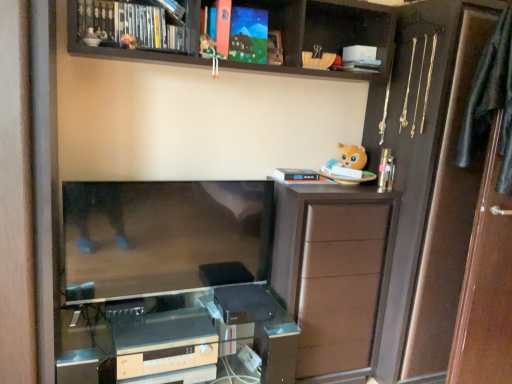
Question: Is silver metallic stereo at lower center, the first appliance from the left, completely or partially inside silver/glass computer desk at lower center?

Choices:
 (A) yes
 (B) no

Answer: (A)

Question: From a real-world perspective, is silver/glass computer desk at lower center positioned under silver metallic stereo at lower center, arranged as the 2th appliance when viewed from the top, based on gravity?

Choices:
 (A) yes
 (B) no

Answer: (A)

Question: Is silver metallic stereo at lower center, the first appliance from the left, at the back of silver/glass computer desk at lower center?

Choices:
 (A) yes
 (B) no

Answer: (A)

Question: Does silver/glass computer desk at lower center lie behind silver metallic stereo at lower center, the first appliance from the left?

Choices:
 (A) yes
 (B) no

Answer: (B)

Question: Does silver/glass computer desk at lower center have a smaller size compared to silver metallic stereo at lower center, acting as the 1th appliance starting from the bottom?

Choices:
 (A) yes
 (B) no

Answer: (B)

Question: Can you confirm if silver/glass computer desk at lower center is positioned to the right of silver metallic stereo at lower center, arranged as the 2th appliance when viewed from the top?

Choices:
 (A) yes
 (B) no

Answer: (A)

Question: Is matte plastic toy at upper center, which is the first toy in left-to-right order, outside of hardcover book at upper center, the 3th book from the left?

Choices:
 (A) no
 (B) yes

Answer: (B)

Question: Are matte plastic toy at upper center, which is the first toy in left-to-right order, and hardcover book at upper center, placed as the 3th book when sorted from top to bottom, beside each other?

Choices:
 (A) yes
 (B) no

Answer: (B)

Question: From a real-world perspective, is matte plastic toy at upper center, which is the first toy in left-to-right order, under hardcover book at upper center, the 3th book from the left?

Choices:
 (A) no
 (B) yes

Answer: (B)

Question: From the image's perspective, would you say matte plastic toy at upper center, which appears as the 2th toy when viewed from the right, is shown under hardcover book at upper center, placed as the 3th book when sorted from top to bottom?

Choices:
 (A) no
 (B) yes

Answer: (B)

Question: Is matte plastic toy at upper center, which is the first toy in left-to-right order, at the right side of hardcover book at upper center, which is counted as the third book, starting from the bottom?

Choices:
 (A) yes
 (B) no

Answer: (B)

Question: Is white matte book at upper center, the 4th book when ordered from left to right, a part of white matte book at upper center, acting as the fifth book starting from the left?

Choices:
 (A) yes
 (B) no

Answer: (B)